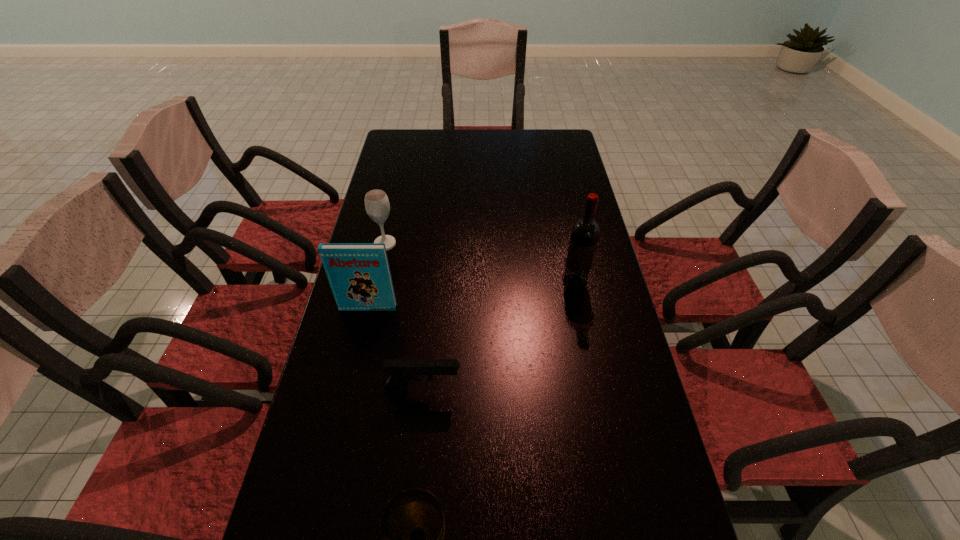
At what (x,y) coordinates should I click in order to perform the action: click on free area in between the second nearest object and the third nearest object. Please return your answer as a coordinate pair (x, y). The height and width of the screenshot is (540, 960). Looking at the image, I should click on (396, 349).

Find the location of `vacant area between the fourth nearest object and the pistol`. vacant area between the fourth nearest object and the pistol is located at coordinates (499, 336).

I want to click on vacant space that is in between the tallest object and the farthest object, so click(480, 263).

Locate an element on the screen. Image resolution: width=960 pixels, height=540 pixels. vacant area that lies between the pistol and the wine bottle is located at coordinates (499, 336).

Image resolution: width=960 pixels, height=540 pixels. In order to click on unoccupied position between the shortest object and the farthest object in this screenshot , I will do `click(404, 316)`.

Locate which object is the fourth closest to the chalice. Please provide its 2D coordinates. Your answer should be formatted as a tuple, i.e. [(x, y)], where the tuple contains the x and y coordinates of a point satisfying the conditions above.

[(377, 205)]

At what (x,y) coordinates should I click in order to perform the action: click on object that is the fourth closest to the farthest object. Please return your answer as a coordinate pair (x, y). Looking at the image, I should click on (412, 526).

You are a GUI agent. You are given a task and a screenshot of the screen. Output one action in this format:
    pyautogui.click(x=<x>, y=<y>)
    Task: Click on the blank space that satisfies the following two spatial constraints: 1. on the front side of the wine bottle; 2. on the right side of the third shortest object
    
    Given the screenshot: What is the action you would take?
    pyautogui.click(x=376, y=282)